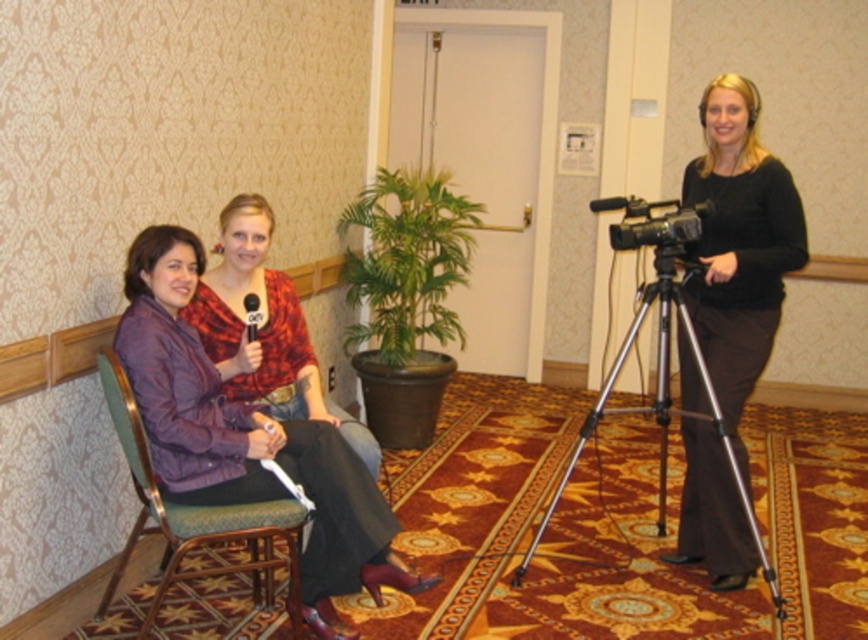
You are setting up equipment for a live stream. You have a black plastic video camera at center and a black plastic microphone at center. Which one requires more space to place on the table?

The black plastic video camera at center requires more space to place on the table since it has a larger size compared to the black plastic microphone at center.

You are a photographer in the room and want to take a photo of both the black plastic video camera at center and the black plastic microphone at center. Which object is closer to you so that it appears larger in the photo?

The black plastic video camera at center is closer to you than the black plastic microphone at center, so it will appear larger in the photo.